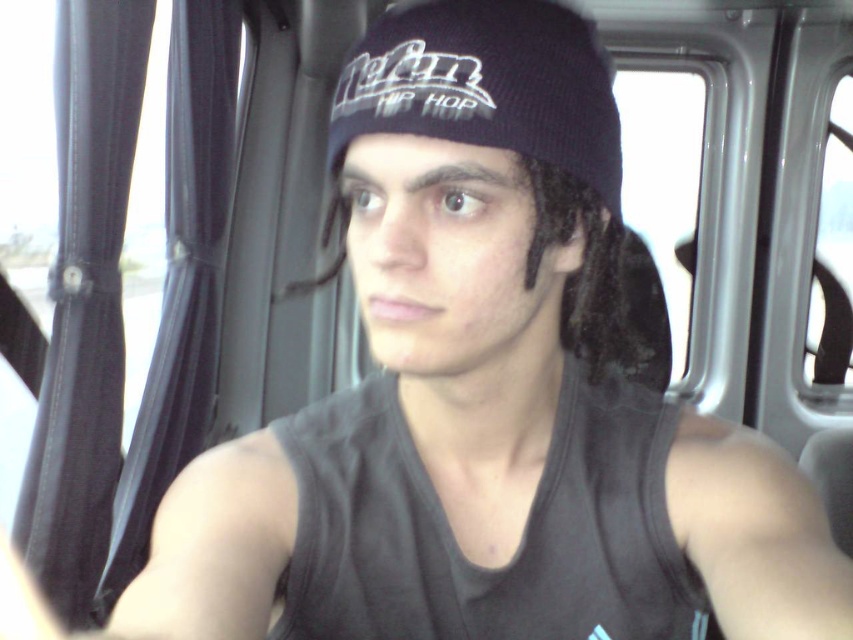
You are a photographer trying to capture a portrait of the person in the vehicle. You notice two muscles visible on their body, the smooth skin muscle at lower right and the muscle at upper right. Which muscle is positioned higher on the person compared to the other?

The smooth skin muscle at lower right is located above the muscle at upper right, meaning it is positioned higher on the person.

You are a photographer standing in front of the smooth skin muscle at lower right. You want to take a clear photo of it. What is the minimum distance you should maintain to ensure the subject fills the frame without distortion?

The smooth skin muscle at lower right and viewer are 17.95 inches apart from each other. To ensure the subject fills the frame without distortion, the photographer should maintain at least 17.95 inches distance from the smooth skin muscle at lower right.